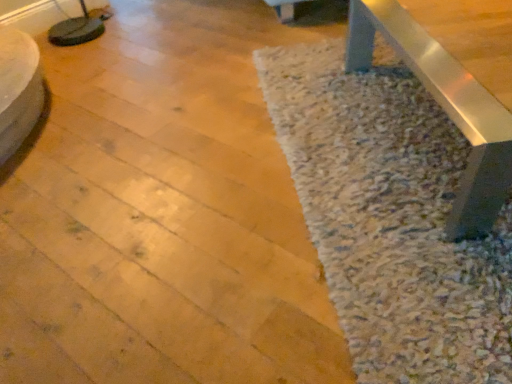
Question: Should I look upward or downward to see white shaggy rug at center?

Choices:
 (A) up
 (B) down

Answer: (A)